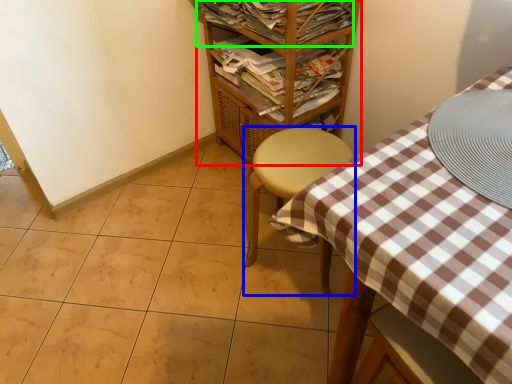
Question: Estimate the real-world distances between objects in this image. Which object is farther from shelf (highlighted by a red box), furniture (highlighted by a blue box) or magazine (highlighted by a green box)?

Choices:
 (A) furniture
 (B) magazine

Answer: (A)